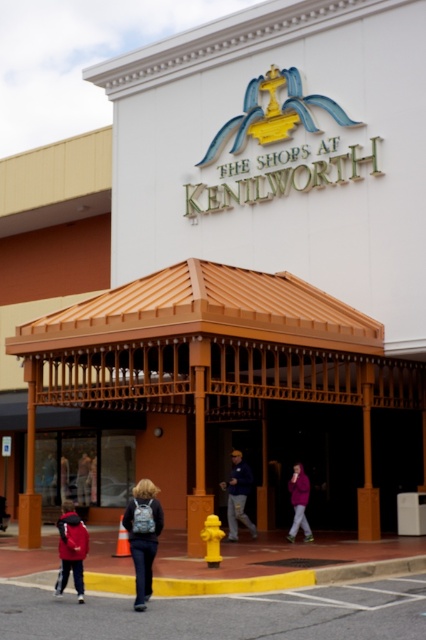
You are standing at the entrance of The Shops at Kenilworth and looking towards the covered walkway. There are two points marked in the scene, point (69, 516) and point (236, 532). Which point is closer to you?

Point (69, 516) is closer to the camera than point (236, 532).

You are a delivery person carrying a package and need to pass through the entrance of The Shops at Kenilworth. You see a denim backpack at center and a dark blue jacket at center. Which item is wider, and will it affect your ability to carry the package through the entrance?

The denim backpack at center is wider than the dark blue jacket at center. Since the backpack is wider, it may affect your ability to carry the package through the entrance if there is limited space.